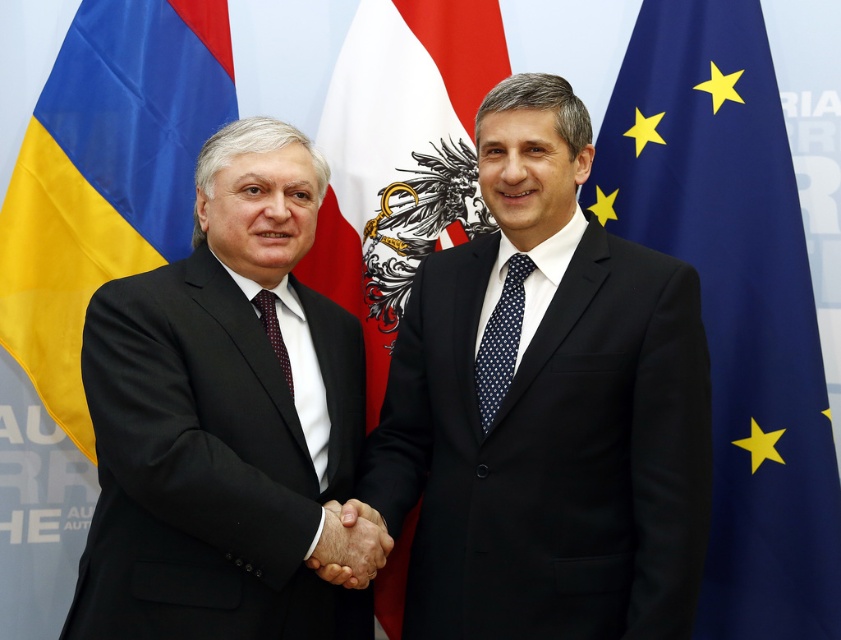
You are a photographer at the event. You need to capture a photo where the smooth skin handshake at center is clearly visible above the navy dotted tie at center. Is this possible based on their current positions?

The smooth skin handshake at center is positioned under the navy dotted tie at center, so it would not be possible to capture the handshake above the tie in the current arrangement.

You are a photographer at a diplomatic event. You need to capture a closeup of the matte black suit at left and the smooth skin handshake at center. Can you focus on both objects simultaneously with your camera set to a narrow depth of field?

The matte black suit at left is positioned over the smooth skin handshake at center, so they are at the same distance from the camera. With a narrow depth of field, the camera can focus on both objects simultaneously.